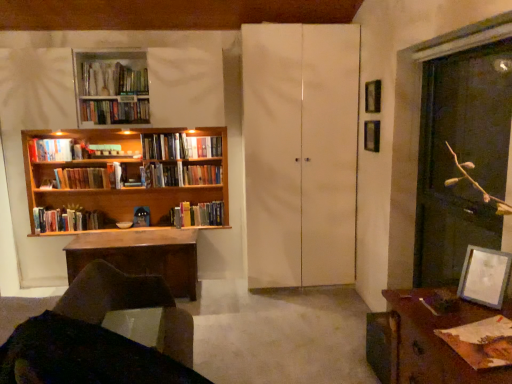
This screenshot has height=384, width=512. What are the coordinates of `empty space that is ontop of transparent glass screen door at right, which ranks as the 2th screen door in left-to-right order (from a real-world perspective)` in the screenshot? It's located at (474, 49).